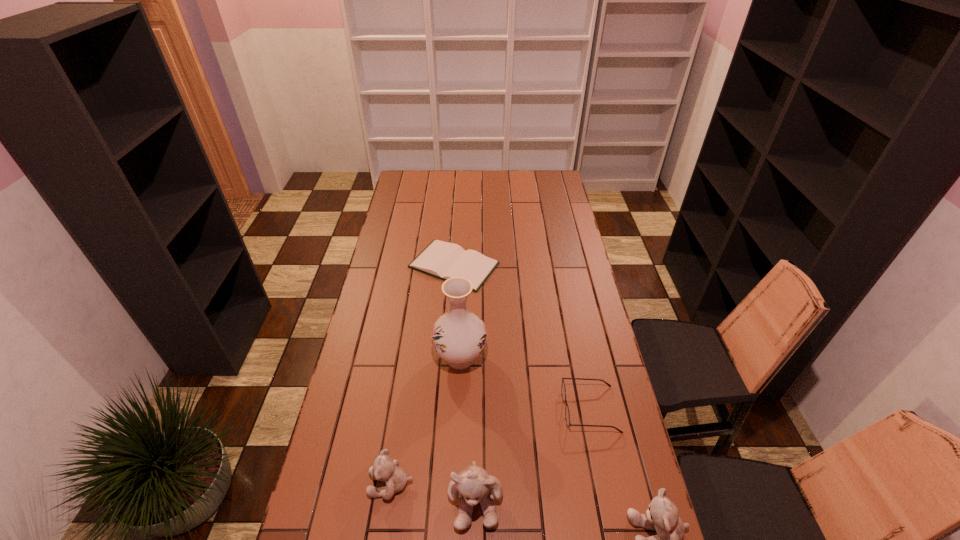
Where is `vacant area situated 0.080m on the face of the shortest teddy bear`? vacant area situated 0.080m on the face of the shortest teddy bear is located at coordinates (340, 484).

Image resolution: width=960 pixels, height=540 pixels. What are the coordinates of `vacant space located 0.070m on the face of the shortest teddy bear` in the screenshot? It's located at (344, 484).

This screenshot has width=960, height=540. Find the location of `free space located on the right of the hardback book`. free space located on the right of the hardback book is located at coordinates (571, 265).

In order to click on free spot located 0.110m on the front-facing side of the second shortest object in this screenshot , I will do `click(529, 409)`.

Locate an element on the screen. vacant space located on the front-facing side of the second shortest object is located at coordinates (544, 409).

Find the location of `vacant position located on the front-facing side of the second shortest object`. vacant position located on the front-facing side of the second shortest object is located at coordinates (544, 409).

Where is `free space located 0.170m on the front of the tallest object`? free space located 0.170m on the front of the tallest object is located at coordinates (458, 427).

Locate an element on the screen. The image size is (960, 540). object located in the near edge section of the desktop is located at coordinates (473, 484).

In order to click on teddy bear at the left edge in this screenshot , I will do `click(385, 469)`.

The height and width of the screenshot is (540, 960). Identify the location of hardback book at the left edge. (443, 260).